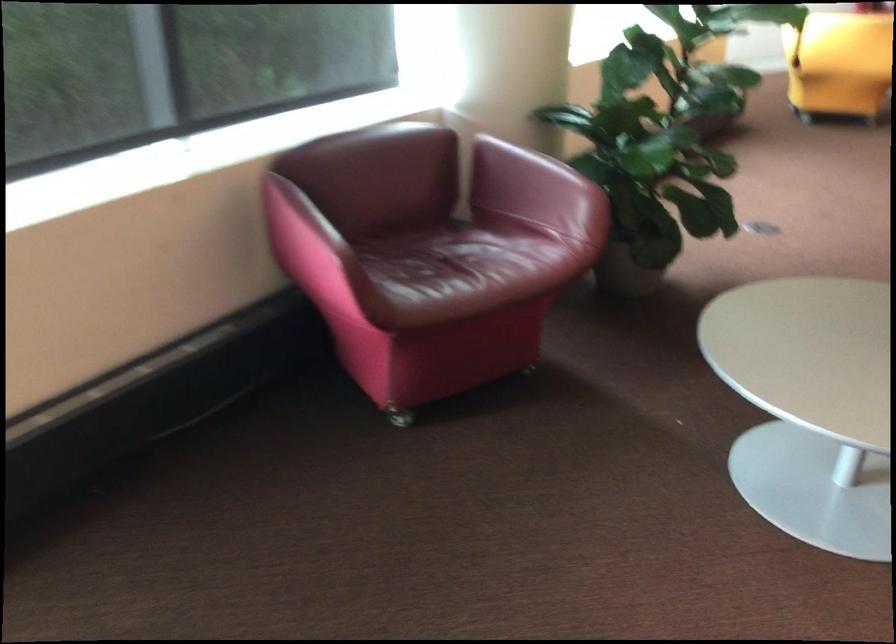
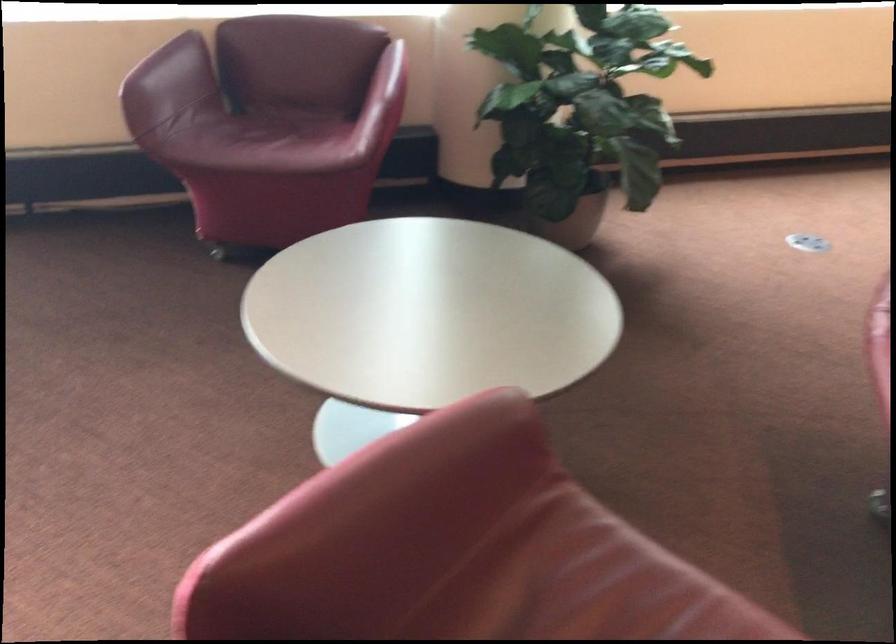
Locate, in the second image, the point that corresponds to point 462,272 in the first image.

(263, 140)